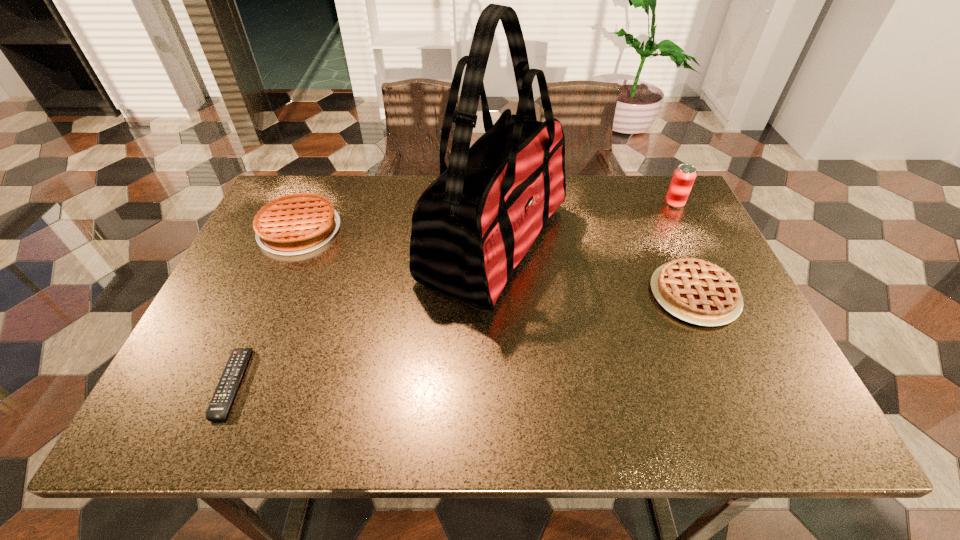
Locate an element on the screen. free space at the far right corner of the desktop is located at coordinates (629, 183).

At what (x,y) coordinates should I click in order to perform the action: click on vacant point located between the nearer pie and the beer can. Please return your answer as a coordinate pair (x, y). Image resolution: width=960 pixels, height=540 pixels. Looking at the image, I should click on (684, 249).

Locate an element on the screen. This screenshot has height=540, width=960. free space between the tallest object and the third shortest object is located at coordinates (396, 237).

The height and width of the screenshot is (540, 960). Identify the location of free space between the duffel bag and the nearest object. (363, 313).

Locate an element on the screen. vacant space that is in between the third object from right to left and the shortest object is located at coordinates (363, 313).

Locate an element on the screen. The width and height of the screenshot is (960, 540). vacant region between the farther pie and the shortest object is located at coordinates (266, 307).

Choose which object is the nearest neighbor to the nearest object. Please provide its 2D coordinates. Your answer should be formatted as a tuple, i.e. [(x, y)], where the tuple contains the x and y coordinates of a point satisfying the conditions above.

[(298, 223)]

Choose which object is the third nearest neighbor to the taller pie. Please provide its 2D coordinates. Your answer should be formatted as a tuple, i.e. [(x, y)], where the tuple contains the x and y coordinates of a point satisfying the conditions above.

[(699, 292)]